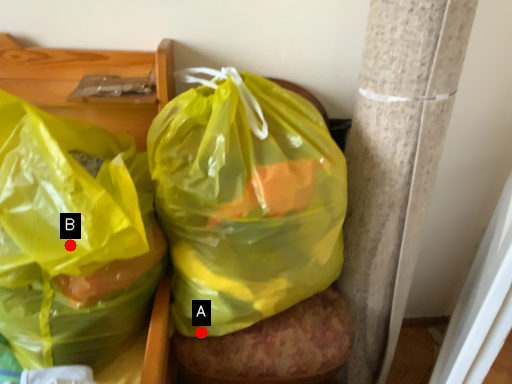
Question: Two points are circled on the image, labeled by A and B beside each circle. Among these points, which one is nearest to the camera?

Choices:
 (A) A is closer
 (B) B is closer

Answer: (B)